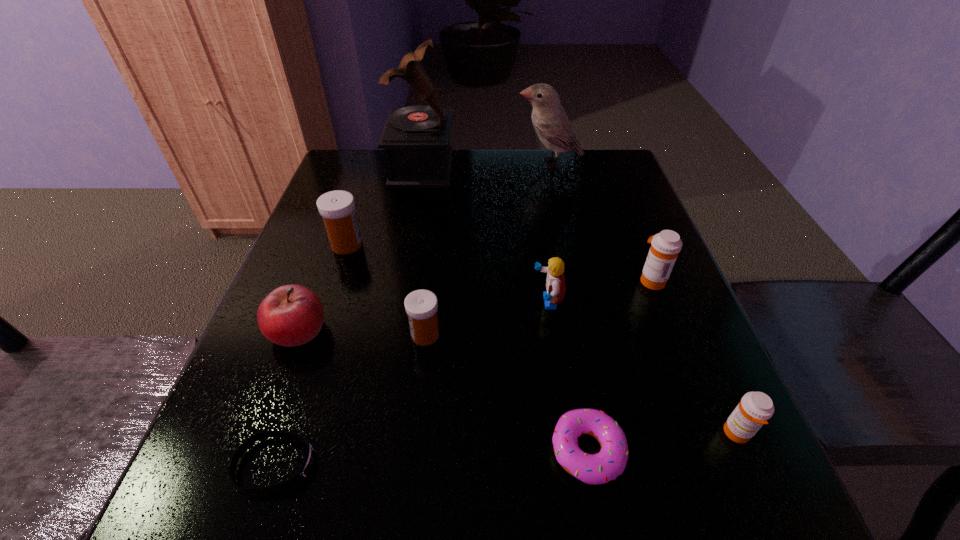
You are a GUI agent. You are given a task and a screenshot of the screen. Output one action in this format:
    pyautogui.click(x=<x>, y=<y>)
    Task: Click on the object present at the near left corner
    The width and height of the screenshot is (960, 540).
    Given the screenshot: What is the action you would take?
    pyautogui.click(x=309, y=458)

Where is `object at the far right corner`? This screenshot has width=960, height=540. object at the far right corner is located at coordinates (550, 121).

Locate an element on the screen. The image size is (960, 540). free space at the far edge of the desktop is located at coordinates (428, 189).

In the image, there is a desktop. Where is `vacant space at the near edge`? This screenshot has height=540, width=960. vacant space at the near edge is located at coordinates (372, 532).

Locate an element on the screen. The height and width of the screenshot is (540, 960). free location at the left edge is located at coordinates (328, 264).

The height and width of the screenshot is (540, 960). In order to click on vacant area at the right edge in this screenshot , I will do `click(608, 197)`.

At what (x,y) coordinates should I click in order to perform the action: click on vacant space at the far left corner of the desktop. Please return your answer as a coordinate pair (x, y). The image size is (960, 540). Looking at the image, I should click on (381, 192).

In the image, there is a desktop. Find the location of `free space at the far right corner`. free space at the far right corner is located at coordinates (594, 148).

Where is `empty space between the pink doughnut and the third medicine from right to left`? empty space between the pink doughnut and the third medicine from right to left is located at coordinates (506, 393).

Find the location of `free area in between the apple and the nearer white medicine`. free area in between the apple and the nearer white medicine is located at coordinates (362, 333).